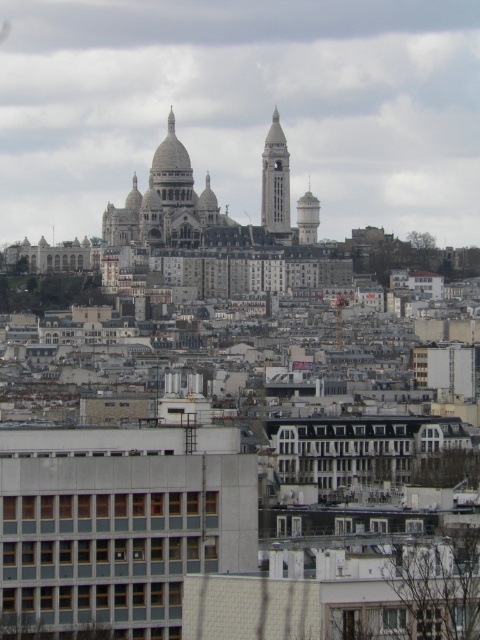
Question: Can you confirm if white stone clock tower at center is thinner than light gray concrete tower at center right?

Choices:
 (A) yes
 (B) no

Answer: (B)

Question: Which point is closer to the camera?

Choices:
 (A) (178, 193)
 (B) (302, 236)
 (C) (274, 216)

Answer: (A)

Question: Which object appears closest to the camera in this image?

Choices:
 (A) white stone clock tower at center
 (B) golden stone church at center

Answer: (B)

Question: Which point is closer to the camera?

Choices:
 (A) (282, 129)
 (B) (170, 237)

Answer: (B)

Question: Is white stone clock tower at center behind light gray concrete tower at center right?

Choices:
 (A) no
 (B) yes

Answer: (A)

Question: In this image, where is white stone clock tower at center located relative to light gray concrete tower at center right?

Choices:
 (A) below
 (B) above

Answer: (B)